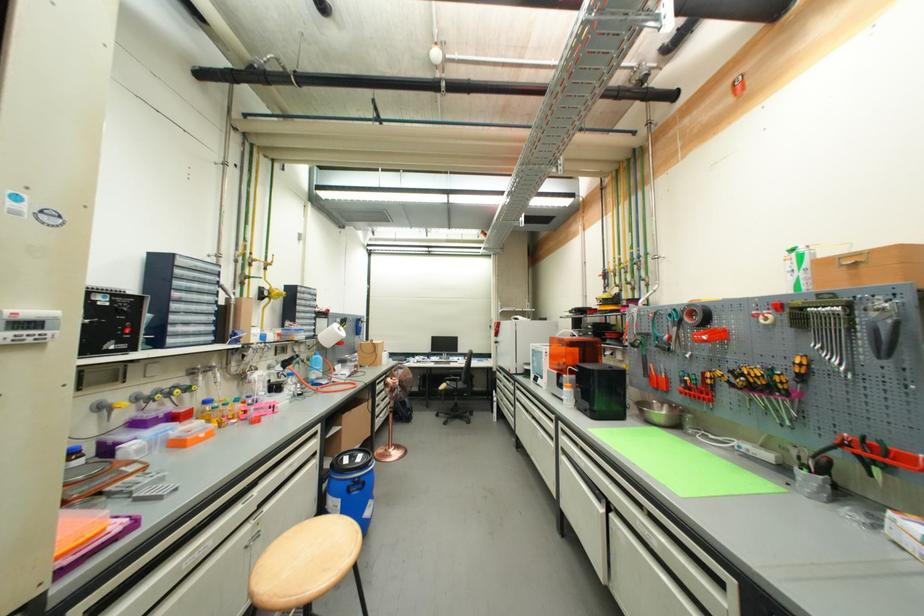
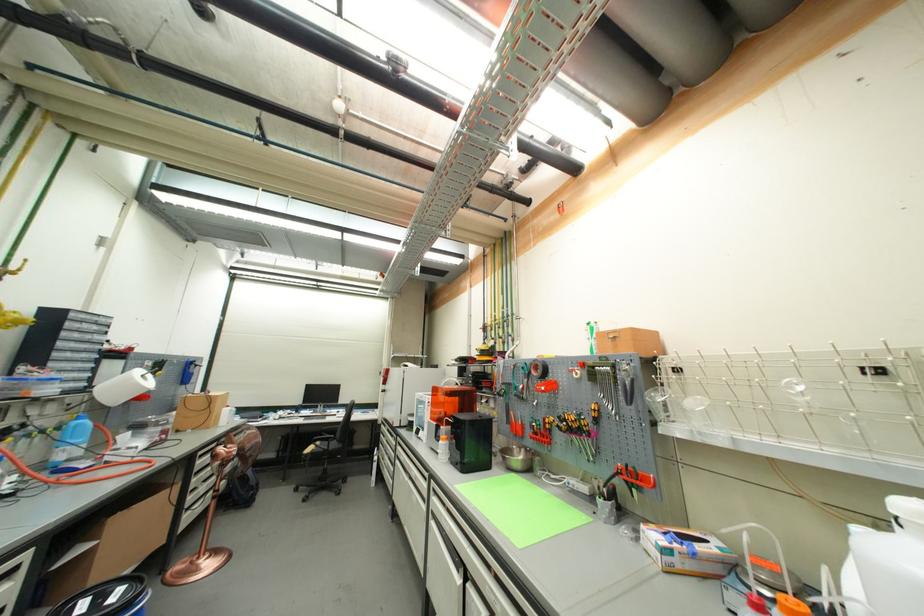
Find the pixel in the second image that matches (764,377) in the first image.

(578, 421)